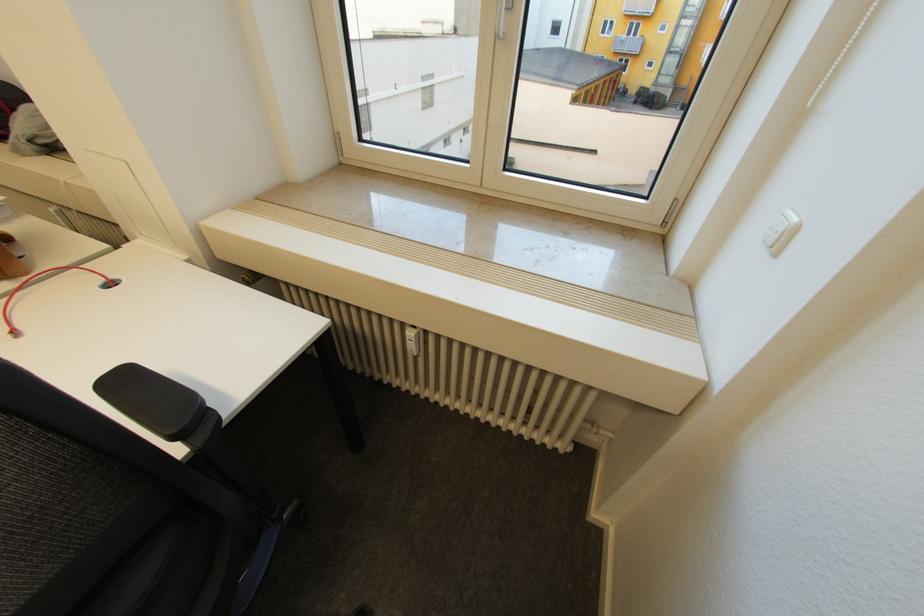
Which object does [782,232] point to?

It corresponds to the white light switch in the image.